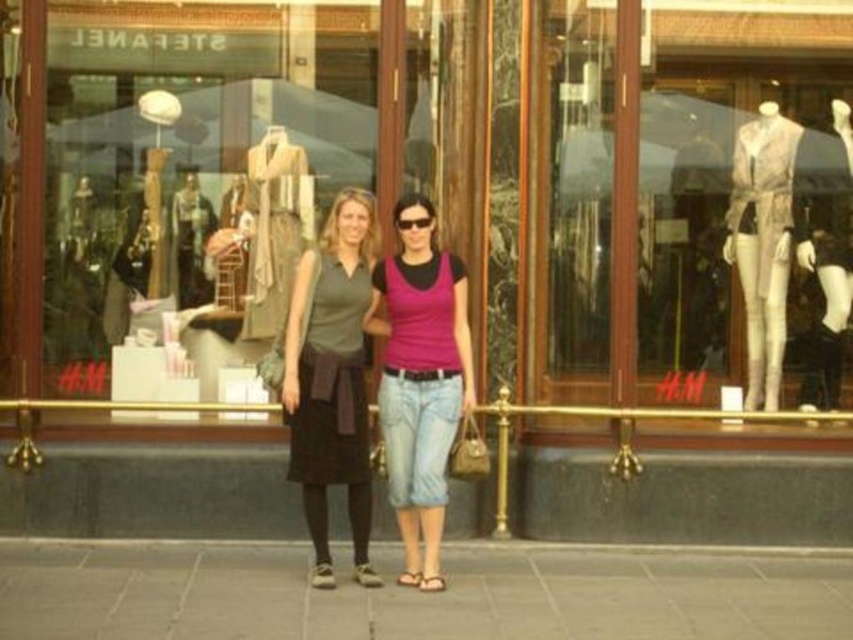
Can you confirm if matte glass display at center is positioned to the left of matte gray skirt at center?

Yes, matte glass display at center is to the left of matte gray skirt at center.

Does matte glass display at center have a lesser width compared to matte gray skirt at center?

Incorrect, matte glass display at center's width is not less than matte gray skirt at center's.

Which is in front, point (222, 170) or point (357, 344)?

Positioned in front is point (357, 344).

Where is `matte glass display at center`? matte glass display at center is located at coordinates (189, 180).

Can you confirm if gray concrete pavement at lower center is bigger than pink matte tank top at center?

No.

Who is higher up, gray concrete pavement at lower center or pink matte tank top at center?

pink matte tank top at center

Is point (810, 628) behind point (434, 420)?

No, it is not.

You are a GUI agent. You are given a task and a screenshot of the screen. Output one action in this format:
    pyautogui.click(x=<x>, y=<y>)
    Task: Click on the gray concrete pavement at lower center
    This screenshot has width=853, height=640.
    Given the screenshot: What is the action you would take?
    pyautogui.click(x=416, y=595)

Who is higher up, pink matte tank top at center or matte gray skirt at center?

Positioned higher is matte gray skirt at center.

Between pink matte tank top at center and matte gray skirt at center, which one appears on the left side from the viewer's perspective?

Positioned to the left is matte gray skirt at center.

Is point (415, 465) behind point (357, 531)?

No, it is in front of (357, 531).

Locate an element on the screen. pink matte tank top at center is located at coordinates (421, 380).